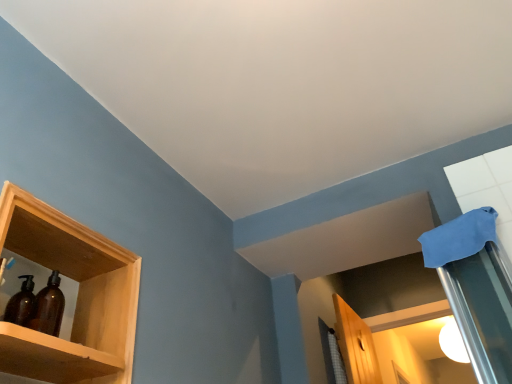
Question: In terms of width, does amber glass bottles at left look wider or thinner when compared to white glossy light bulb at upper right?

Choices:
 (A) thin
 (B) wide

Answer: (A)

Question: Considering the relative positions of amber glass bottles at left and white glossy light bulb at upper right in the image provided, is amber glass bottles at left to the left or to the right of white glossy light bulb at upper right?

Choices:
 (A) left
 (B) right

Answer: (A)

Question: Which of these objects is positioned farthest from the amber glass bottles at left?

Choices:
 (A) wooden shelf at left
 (B) white glossy light bulb at upper right

Answer: (B)

Question: Which object is positioned closest to the white glossy light bulb at upper right?

Choices:
 (A) amber glass bottles at left
 (B) wooden shelf at left

Answer: (B)